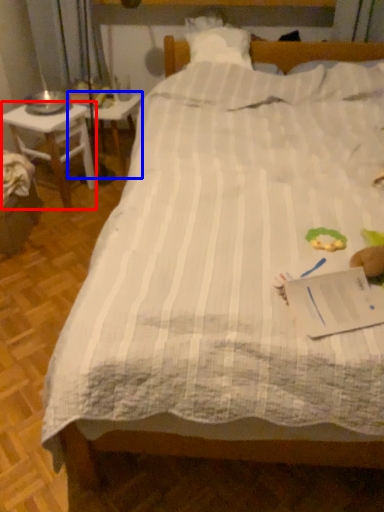
Question: Among these objects, which one is nearest to the camera, desk (highlighted by a red box) or table (highlighted by a blue box)?

Choices:
 (A) desk
 (B) table

Answer: (A)